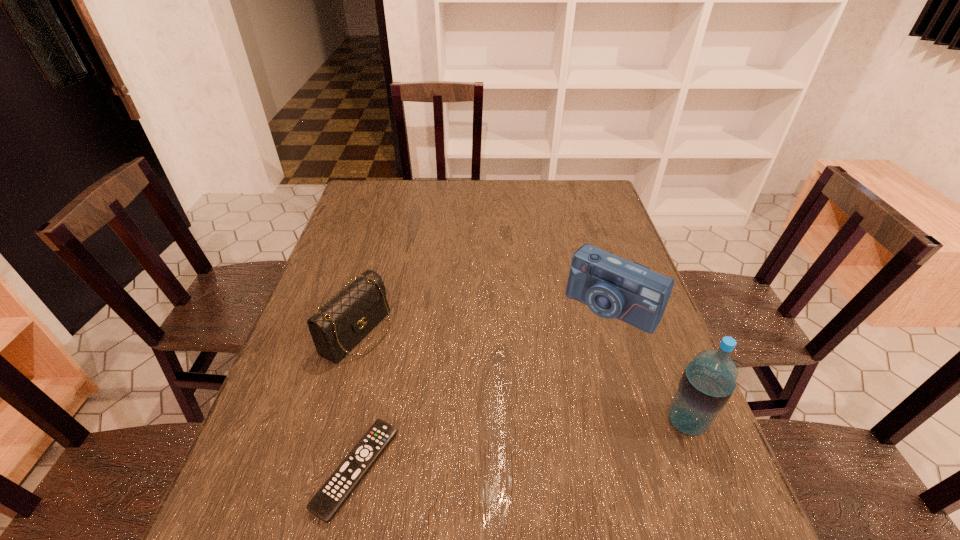
This screenshot has width=960, height=540. What are the coordinates of `remote control` in the screenshot? It's located at (327, 501).

Locate an element on the screen. The height and width of the screenshot is (540, 960). the tallest object is located at coordinates (708, 381).

Locate an element on the screen. Image resolution: width=960 pixels, height=540 pixels. clutch bag is located at coordinates (341, 323).

Where is `camera`? The width and height of the screenshot is (960, 540). camera is located at coordinates pos(612,287).

Locate an element on the screen. vacant region located 0.400m on the right of the shortest object is located at coordinates (601, 470).

What are the coordinates of `vacant region located on the back of the water bottle` in the screenshot? It's located at (663, 363).

The image size is (960, 540). Find the location of `vacant space situated 0.350m on the front flap of the clutch bag`. vacant space situated 0.350m on the front flap of the clutch bag is located at coordinates pos(510,411).

Find the location of `free region located on the front flap of the clutch bag`. free region located on the front flap of the clutch bag is located at coordinates (x=482, y=397).

You are a GUI agent. You are given a task and a screenshot of the screen. Output one action in this format:
    pyautogui.click(x=<x>, y=<y>)
    Task: Click on the vacant space situated on the front flap of the clutch bag
    
    Given the screenshot: What is the action you would take?
    pyautogui.click(x=510, y=411)

Locate an element on the screen. The height and width of the screenshot is (540, 960). vacant point located 0.330m on the lens of the camera is located at coordinates (515, 421).